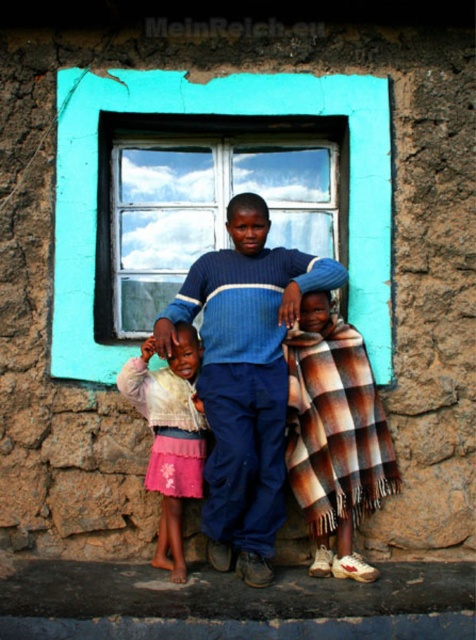
Is teal glass window at center wider than blue knitted sweater at center?

Indeed, teal glass window at center has a greater width compared to blue knitted sweater at center.

Who is lower down, teal glass window at center or blue knitted sweater at center?

blue knitted sweater at center is below.

This screenshot has width=476, height=640. What do you see at coordinates (200, 198) in the screenshot?
I see `teal glass window at center` at bounding box center [200, 198].

Where is `teal glass window at center`? teal glass window at center is located at coordinates (200, 198).

Which is behind, point (316, 513) or point (162, 547)?

Positioned behind is point (162, 547).

Where is `plaid woolen blanket at center`? This screenshot has width=476, height=640. plaid woolen blanket at center is located at coordinates (335, 428).

In the scene shown: Can you confirm if blue knitted sweater at center is thinner than plaid woolen blanket at center?

No, blue knitted sweater at center is not thinner than plaid woolen blanket at center.

This screenshot has height=640, width=476. I want to click on blue knitted sweater at center, so click(x=245, y=378).

The image size is (476, 640). Identify the location of blue knitted sweater at center. (245, 378).